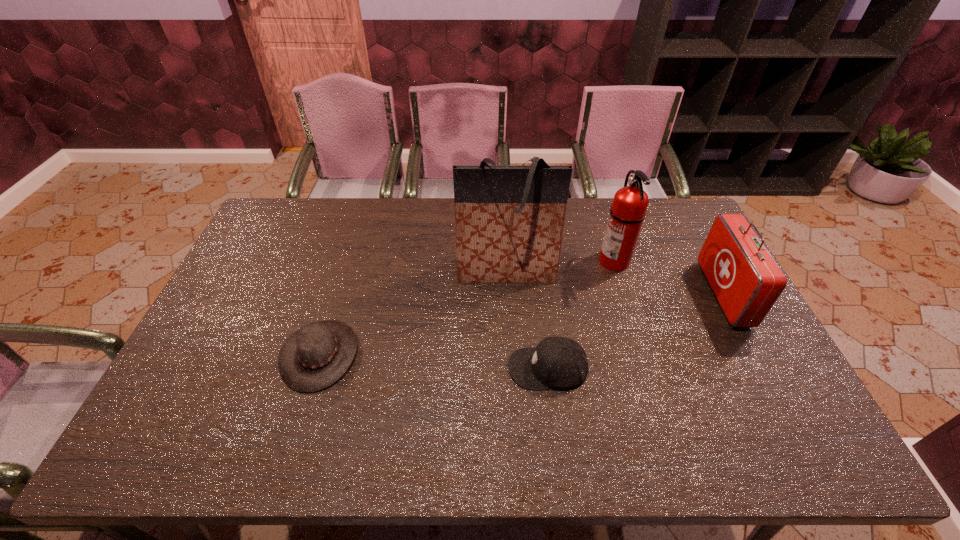
I want to click on free spot located at the nozzle of the second object from right to left, so click(x=541, y=261).

I want to click on vacant region located on the side of the first-aid kit with the first aid cross symbol, so click(583, 294).

Where is `free space located 0.130m on the side of the first-aid kit with the first aid cross symbol`? The width and height of the screenshot is (960, 540). free space located 0.130m on the side of the first-aid kit with the first aid cross symbol is located at coordinates click(x=670, y=294).

Image resolution: width=960 pixels, height=540 pixels. Find the location of `vacant area situated on the side of the first-aid kit with the first aid cross symbol`. vacant area situated on the side of the first-aid kit with the first aid cross symbol is located at coordinates (657, 294).

Identify the location of vacant position located on the front-facing side of the cap. (390, 368).

Where is `vacant space located on the front-facing side of the cap`? The image size is (960, 540). vacant space located on the front-facing side of the cap is located at coordinates (426, 368).

Find the location of a particular element. free space located 0.310m on the front-facing side of the cap is located at coordinates (393, 368).

You are a GUI agent. You are given a task and a screenshot of the screen. Output one action in this format:
    pyautogui.click(x=<x>, y=<y>)
    Task: Click on the vacant region located 0.200m on the front-facing side of the leftmost object
    The image size is (960, 540).
    Given the screenshot: What is the action you would take?
    pyautogui.click(x=430, y=354)

Locate an element on the screen. This screenshot has width=960, height=540. object that is at the right edge is located at coordinates (746, 280).

Identify the location of free space at the far edge of the desktop. (439, 205).